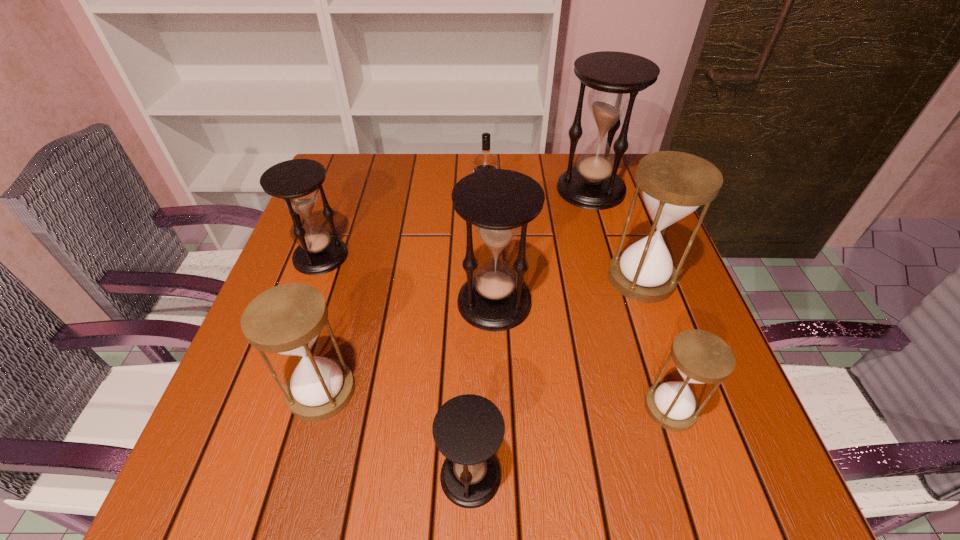
Where is `object at the far edge`? The image size is (960, 540). object at the far edge is located at coordinates (616, 78).

Identify the location of object that is at the near edge. (468, 430).

The height and width of the screenshot is (540, 960). Find the location of `object situated at the far right corner`. object situated at the far right corner is located at coordinates (616, 78).

In order to click on vacant point at the far edge in this screenshot , I will do `click(413, 172)`.

The image size is (960, 540). In the image, there is a desktop. What are the coordinates of `vacant area at the near edge` in the screenshot? It's located at (397, 502).

In order to click on vacant space at the left edge of the desktop in this screenshot , I will do `click(275, 396)`.

Find the location of a particular element. The width and height of the screenshot is (960, 540). free region at the right edge is located at coordinates (664, 440).

Locate an element on the screen. vacant area at the far left corner is located at coordinates (380, 166).

In the image, there is a desktop. Where is `vacant space at the near left corner`? Image resolution: width=960 pixels, height=540 pixels. vacant space at the near left corner is located at coordinates (290, 496).

At what (x,y) coordinates should I click in order to perform the action: click on empty space that is in between the third smallest black hourglass and the smallest white hourglass. Please return your answer as a coordinate pair (x, y). Image resolution: width=960 pixels, height=540 pixels. Looking at the image, I should click on (583, 355).